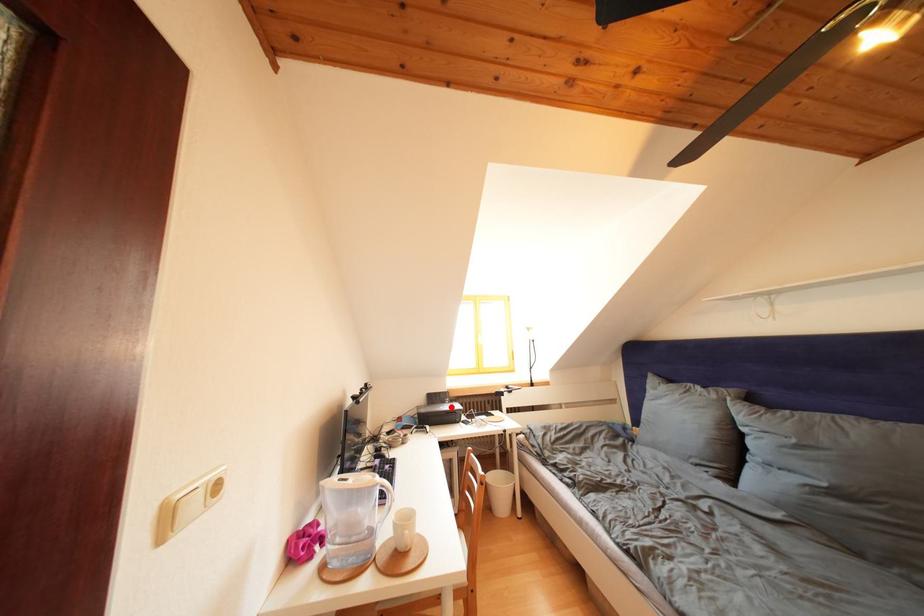
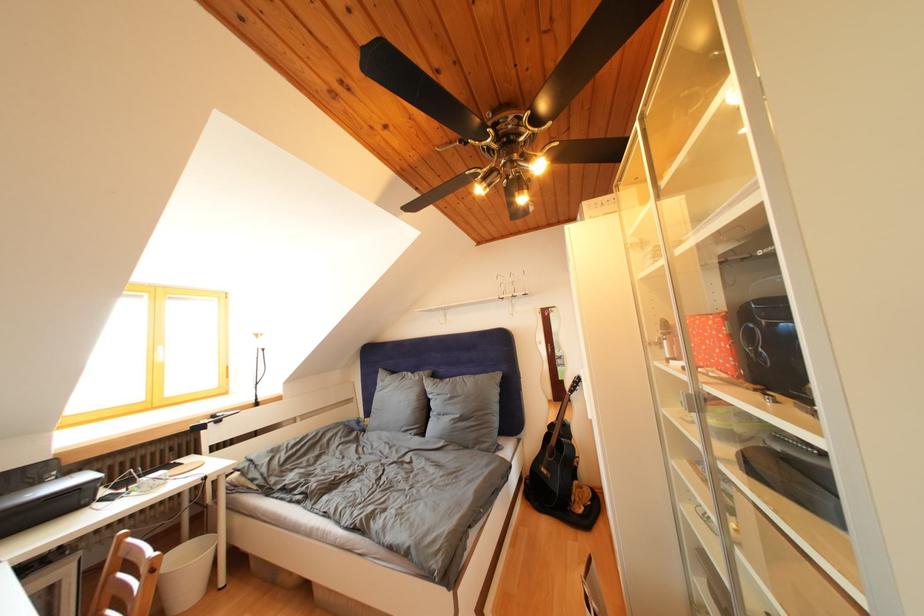
Question: I am providing you with two images of the same scene from different viewpoints. In image1, a red point is highlighted. Considering the same 3D point in image2, which of the following is correct?

Choices:
 (A) It is closer
 (B) It is farther

Answer: (A)